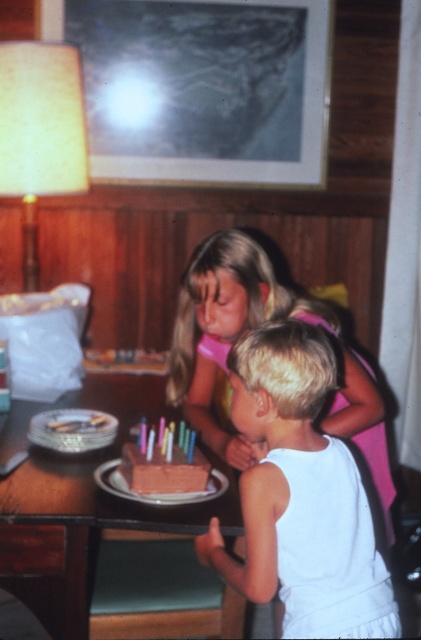
Looking at this image, does white matte tank top at center appear under chocolate matte cake at center?

No, white matte tank top at center is not below chocolate matte cake at center.

Which is below, white matte tank top at center or chocolate matte cake at center?

Positioned lower is chocolate matte cake at center.

Is point (258, 499) farther from camera compared to point (133, 451)?

No, (258, 499) is in front of (133, 451).

Identify the location of white matte tank top at center. The width and height of the screenshot is (421, 640). (301, 496).

Which is behind, point (181, 612) or point (127, 444)?

The point (181, 612) is more distant.

Can you confirm if chocolate cake at center is shorter than chocolate matte cake at center?

Incorrect, chocolate cake at center's height does not fall short of chocolate matte cake at center's.

What do you see at coordinates (79, 508) in the screenshot? The width and height of the screenshot is (421, 640). I see `chocolate cake at center` at bounding box center [79, 508].

Where is `chocolate cake at center`? The image size is (421, 640). chocolate cake at center is located at coordinates (79, 508).

Between white matte tank top at center and chocolate cake at center, which one is positioned higher?

Positioned higher is white matte tank top at center.

Does white matte tank top at center come behind chocolate cake at center?

No, white matte tank top at center is in front of chocolate cake at center.

Does point (244, 392) come farther from viewer compared to point (210, 506)?

No, (244, 392) is closer to viewer.

Image resolution: width=421 pixels, height=640 pixels. Find the location of `white matte tank top at center`. white matte tank top at center is located at coordinates (301, 496).